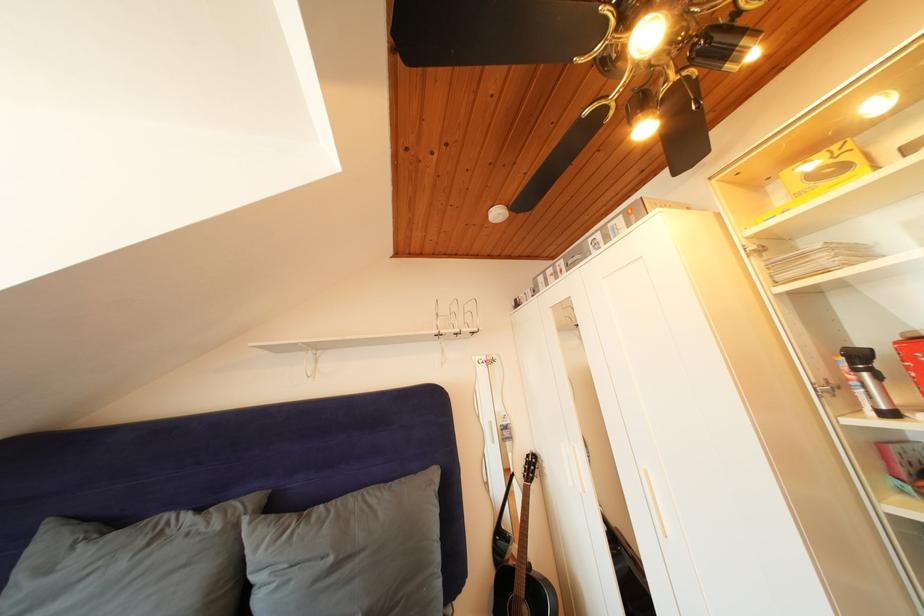
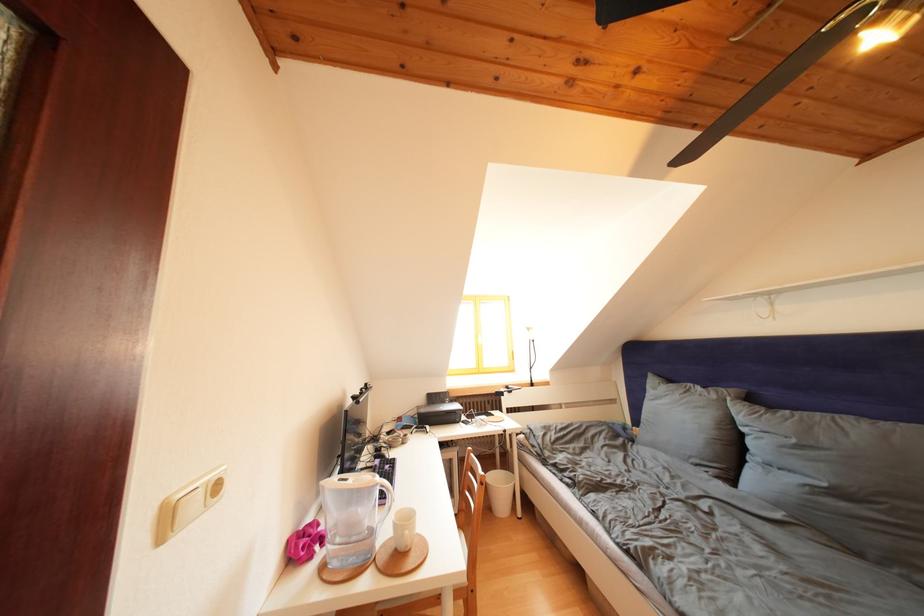
The point at [225,531] is marked in the first image. Where is the corresponding point in the second image?

(722, 402)